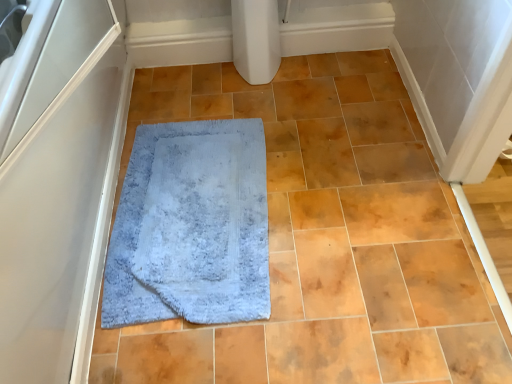
Question: Is light blue shaggy rug at center oriented towards blue soft carpet at center?

Choices:
 (A) no
 (B) yes

Answer: (B)

Question: Can you confirm if light blue shaggy rug at center is bigger than blue soft carpet at center?

Choices:
 (A) yes
 (B) no

Answer: (B)

Question: Is light blue shaggy rug at center to the right of blue soft carpet at center from the viewer's perspective?

Choices:
 (A) no
 (B) yes

Answer: (A)

Question: Is light blue shaggy rug at center further to the viewer compared to blue soft carpet at center?

Choices:
 (A) no
 (B) yes

Answer: (B)

Question: Is light blue shaggy rug at center turned away from blue soft carpet at center?

Choices:
 (A) no
 (B) yes

Answer: (B)

Question: Considering the positions of point (308, 296) and point (37, 251), is point (308, 296) closer or farther from the camera than point (37, 251)?

Choices:
 (A) farther
 (B) closer

Answer: (A)

Question: Looking at the image, does blue soft carpet at center seem bigger or smaller compared to white matte screen door at left?

Choices:
 (A) small
 (B) big

Answer: (A)

Question: In the image, is blue soft carpet at center on the left side or the right side of white matte screen door at left?

Choices:
 (A) right
 (B) left

Answer: (A)

Question: Would you say blue soft carpet at center is inside or outside white matte screen door at left?

Choices:
 (A) outside
 (B) inside

Answer: (A)

Question: From the image's perspective, is blue soft carpet at center above or below light blue shaggy rug at center?

Choices:
 (A) above
 (B) below

Answer: (A)

Question: Considering the relative positions of blue soft carpet at center and light blue shaggy rug at center in the image provided, is blue soft carpet at center to the left or to the right of light blue shaggy rug at center?

Choices:
 (A) left
 (B) right

Answer: (B)

Question: Is blue soft carpet at center inside the boundaries of light blue shaggy rug at center, or outside?

Choices:
 (A) inside
 (B) outside

Answer: (B)

Question: Is blue soft carpet at center taller or shorter than light blue shaggy rug at center?

Choices:
 (A) tall
 (B) short

Answer: (A)

Question: In terms of width, does light blue shaggy rug at center look wider or thinner when compared to blue soft carpet at center?

Choices:
 (A) thin
 (B) wide

Answer: (A)

Question: Is light blue shaggy rug at center spatially inside blue soft carpet at center, or outside of it?

Choices:
 (A) inside
 (B) outside

Answer: (A)